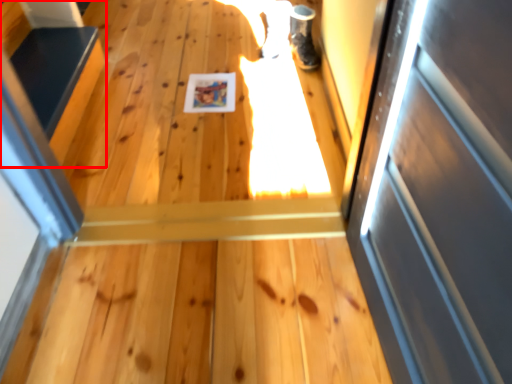
Question: In this image, where is stairs (annotated by the red box) located relative to shoe?

Choices:
 (A) left
 (B) right

Answer: (A)